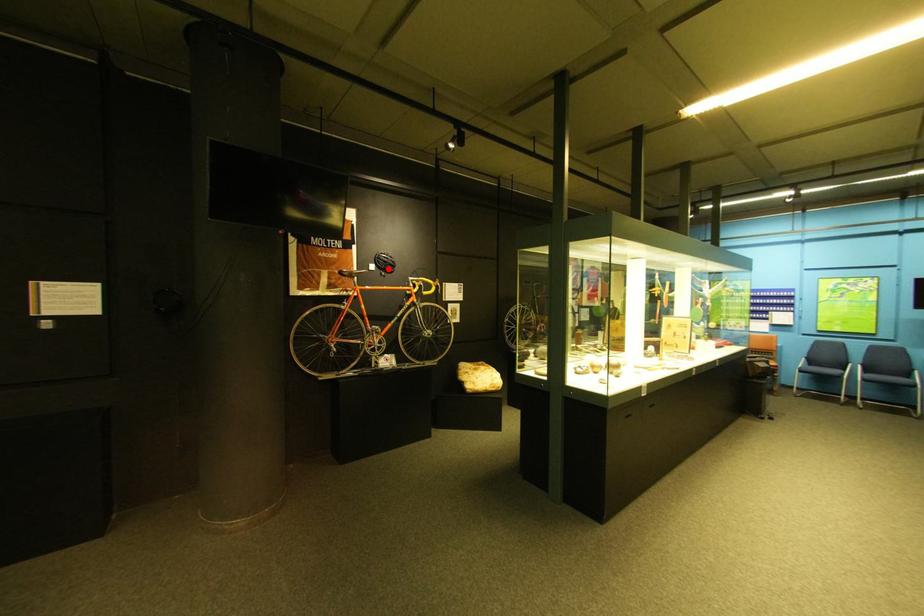
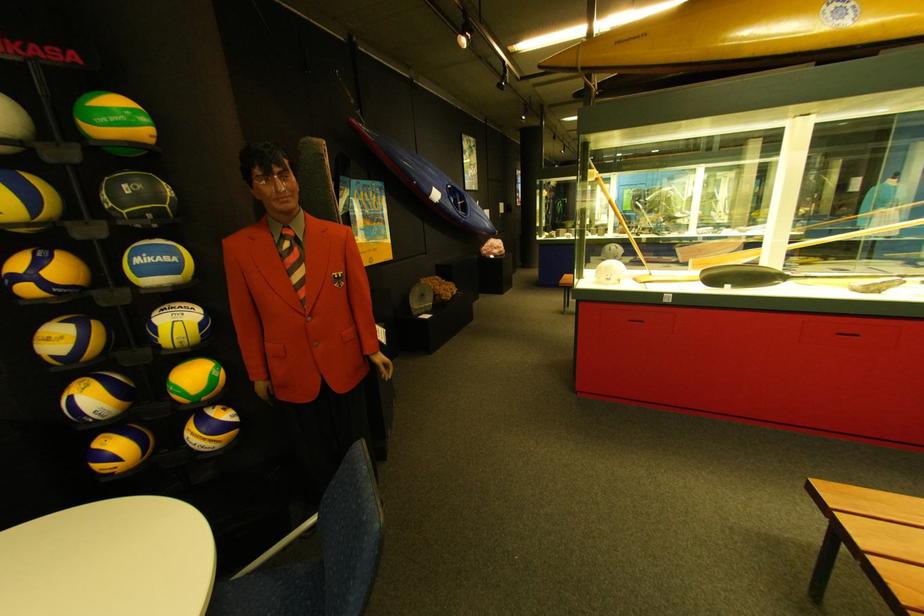
Question: I am providing you with two images of the same scene from different viewpoints. A red point is marked on the first image. At the location where the point appears in image 1, is it still visible in image 2?

Choices:
 (A) Yes
 (B) No

Answer: (B)